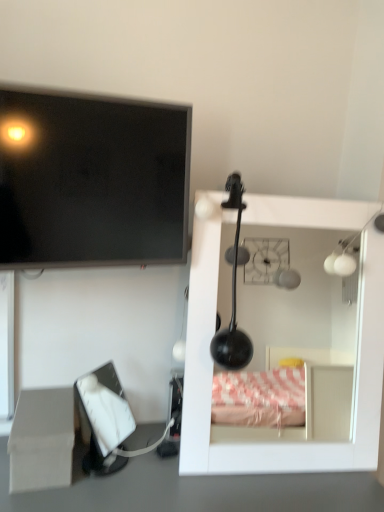
Question: Considering the relative sizes of white glossy mirror at upper right and beige cardboard box at lower left in the image provided, is white glossy mirror at upper right thinner than beige cardboard box at lower left?

Choices:
 (A) no
 (B) yes

Answer: (B)

Question: Is white glossy mirror at upper right to the left of beige cardboard box at lower left from the viewer's perspective?

Choices:
 (A) yes
 (B) no

Answer: (B)

Question: Does white glossy mirror at upper right touch beige cardboard box at lower left?

Choices:
 (A) yes
 (B) no

Answer: (B)

Question: Is beige cardboard box at lower left inside white glossy mirror at upper right?

Choices:
 (A) no
 (B) yes

Answer: (A)

Question: Is white glossy mirror at upper right bigger than beige cardboard box at lower left?

Choices:
 (A) no
 (B) yes

Answer: (B)

Question: Is white matte tissue box at lower left spatially inside beige cardboard box at lower left, or outside of it?

Choices:
 (A) inside
 (B) outside

Answer: (B)

Question: In terms of height, does white matte tissue box at lower left look taller or shorter compared to beige cardboard box at lower left?

Choices:
 (A) tall
 (B) short

Answer: (A)

Question: Is point (125, 403) positioned closer to the camera than point (24, 428)?

Choices:
 (A) farther
 (B) closer

Answer: (A)

Question: From the image's perspective, is white matte tissue box at lower left above or below beige cardboard box at lower left?

Choices:
 (A) above
 (B) below

Answer: (A)

Question: Relative to white matte tissue box at lower left, is beige cardboard box at lower left in front or behind?

Choices:
 (A) front
 (B) behind

Answer: (A)

Question: Is beige cardboard box at lower left taller or shorter than white matte tissue box at lower left?

Choices:
 (A) tall
 (B) short

Answer: (B)

Question: Is beige cardboard box at lower left bigger or smaller than white matte tissue box at lower left?

Choices:
 (A) big
 (B) small

Answer: (B)

Question: Does point (34, 474) appear closer or farther from the camera than point (94, 463)?

Choices:
 (A) farther
 (B) closer

Answer: (B)

Question: Is point (331, 404) closer or farther from the camera than point (170, 240)?

Choices:
 (A) farther
 (B) closer

Answer: (A)

Question: From the image's perspective, is white glossy mirror at upper right located above or below matte black screen at upper left?

Choices:
 (A) below
 (B) above

Answer: (A)